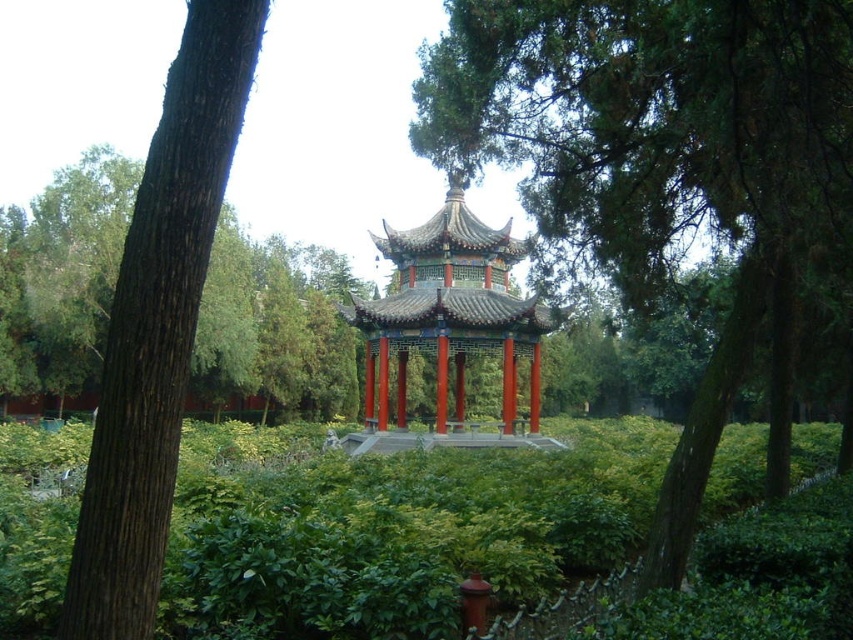
Question: Which of the following is the closest to the observer?

Choices:
 (A) brown rough bark tree at left
 (B) shiny red gazebo at center
 (C) green leafy tree at center
 (D) green rough bark tree at left

Answer: (A)

Question: Which is nearer to the brown rough bark tree at left?

Choices:
 (A) green rough bark tree at left
 (B) shiny red gazebo at center
 (C) green leafy tree at center

Answer: (C)

Question: Is brown rough bark tree at left above shiny red gazebo at center?

Choices:
 (A) yes
 (B) no

Answer: (A)

Question: Is brown rough bark tree at left below shiny red gazebo at center?

Choices:
 (A) yes
 (B) no

Answer: (B)

Question: Which point is closer to the camera?

Choices:
 (A) (570, 131)
 (B) (376, 236)
 (C) (200, 230)
 (D) (231, 243)

Answer: (C)

Question: Does green leafy tree at center appear under green rough bark tree at left?

Choices:
 (A) yes
 (B) no

Answer: (B)